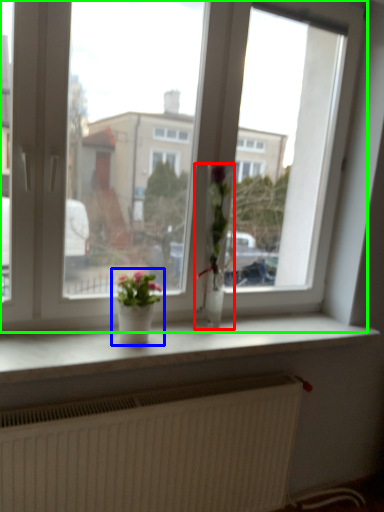
Question: Estimate the real-world distances between objects in this image. Which object is farther from houseplant (highlighted by a red box), houseplant (highlighted by a blue box) or window (highlighted by a green box)?

Choices:
 (A) houseplant
 (B) window

Answer: (A)